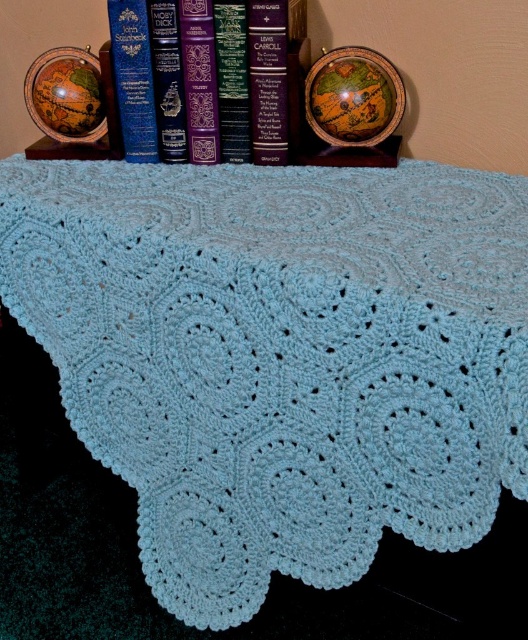
Is purple leather book at center to the right of hardcover book at center from the viewer's perspective?

Incorrect, purple leather book at center is not on the right side of hardcover book at center.

Is point (127, 109) closer to viewer compared to point (277, 26)?

No, it is not.

Who is more distant from viewer, (137, 124) or (257, 58)?

Positioned behind is point (137, 124).

This screenshot has width=528, height=640. In order to click on purple leather book at center in this screenshot , I will do `click(146, 76)`.